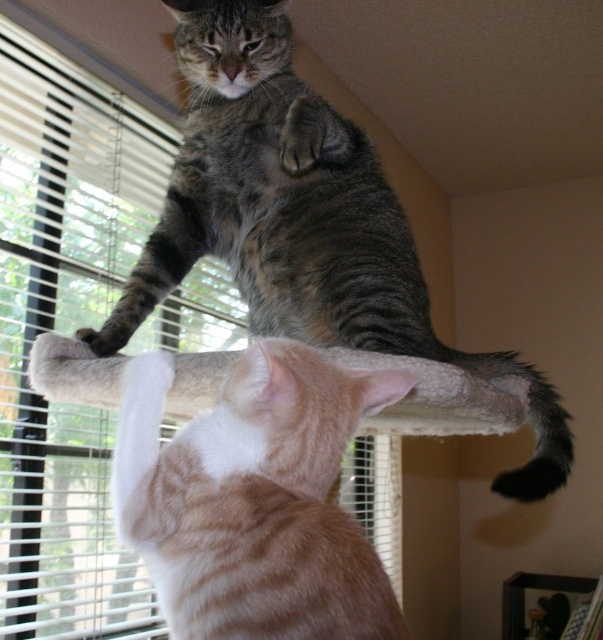
You are a cat owner who wants to place a new toy between the gray tabby cat at upper center and the orange tabby cat at upper center on the cat tree. Based on their positions, where should you place the toy so that it is between them?

The gray tabby cat at upper center is above the orange tabby cat at upper center, so placing the toy below the gray tabby cat at upper center and above the orange tabby cat at upper center would position it between them.